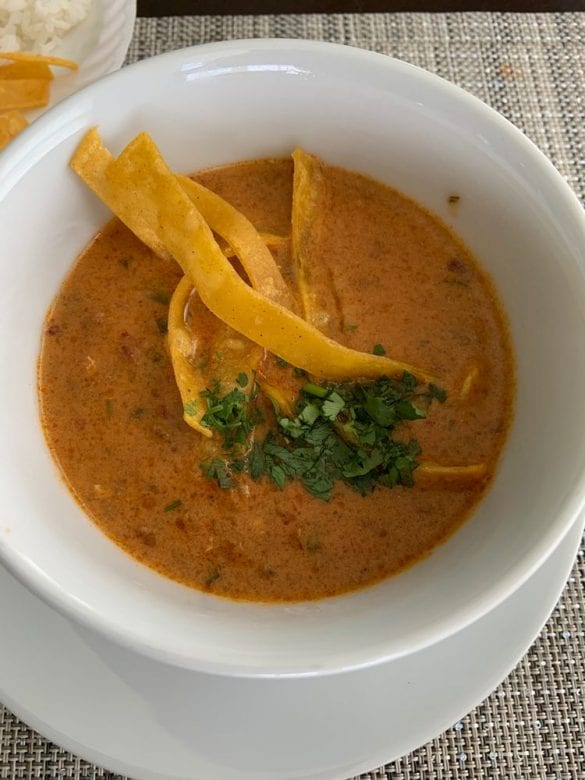
The image size is (585, 780). Find the location of `light`. light is located at coordinates (254, 69).